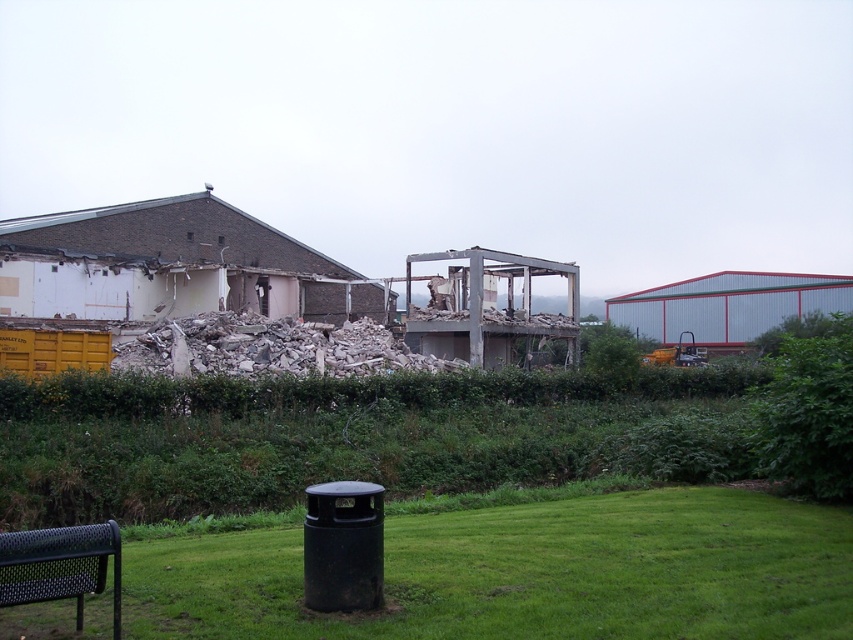
Can you confirm if green grass at lower center is thinner than green leafy hedge at lower right?

Correct, green grass at lower center's width is less than green leafy hedge at lower right's.

Which is in front, point (236, 621) or point (753, 404)?

Point (236, 621)

You are a GUI agent. You are given a task and a screenshot of the screen. Output one action in this format:
    pyautogui.click(x=<x>, y=<y>)
    Task: Click on the green grass at lower center
    Image resolution: width=853 pixels, height=640 pixels.
    Given the screenshot: What is the action you would take?
    click(x=527, y=573)

Is green grass at lower center closer to the viewer compared to black mesh park bench at lower left?

No.

Is point (445, 525) positioned before point (51, 589)?

That is False.

Does point (729, 620) come behind point (90, 580)?

Yes, point (729, 620) is farther from viewer.

The image size is (853, 640). In order to click on green grass at lower center in this screenshot , I will do `click(527, 573)`.

Does green leafy hedge at lower right have a greater width compared to black mesh park bench at lower left?

Indeed, green leafy hedge at lower right has a greater width compared to black mesh park bench at lower left.

What are the coordinates of `green leafy hedge at lower right` in the screenshot? It's located at (805, 406).

Describe the element at coordinates (805, 406) in the screenshot. I see `green leafy hedge at lower right` at that location.

Where is `green leafy hedge at lower right`? green leafy hedge at lower right is located at coordinates (805, 406).